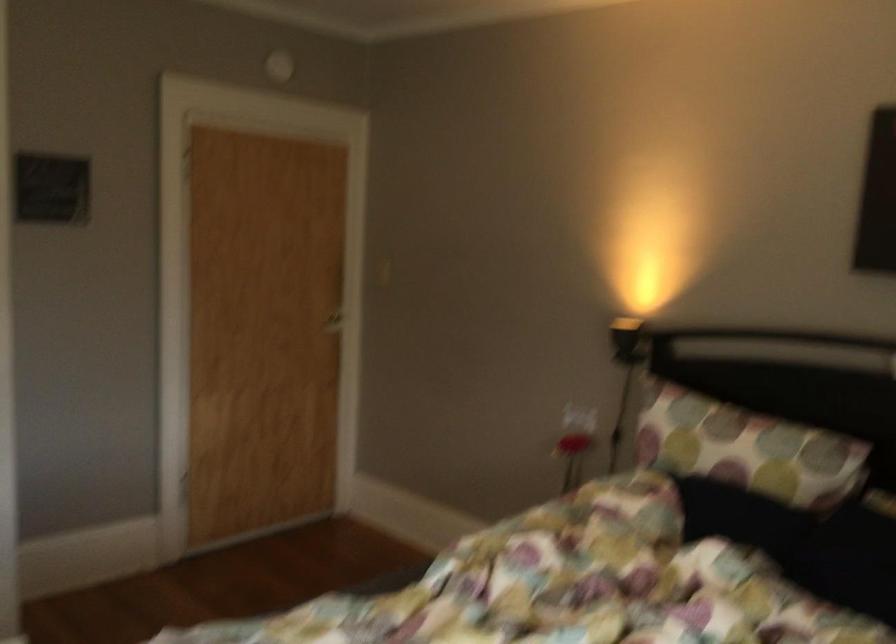
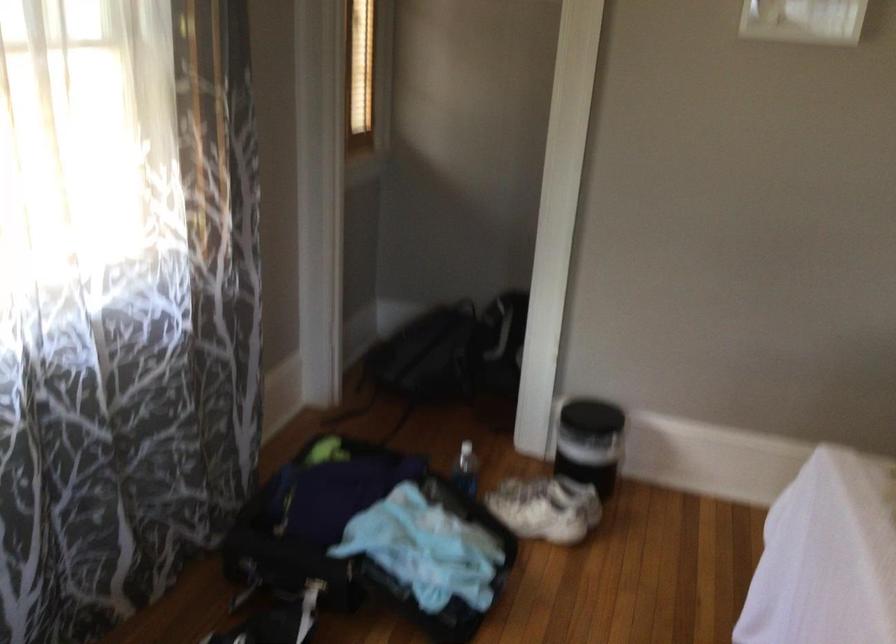
Question: The camera is either moving clockwise (left) or counter-clockwise (right) around the object. The first image is from the beginning of the video and the second image is from the end. Is the camera moving left or right when shooting the video?

Choices:
 (A) Left
 (B) Right

Answer: (B)